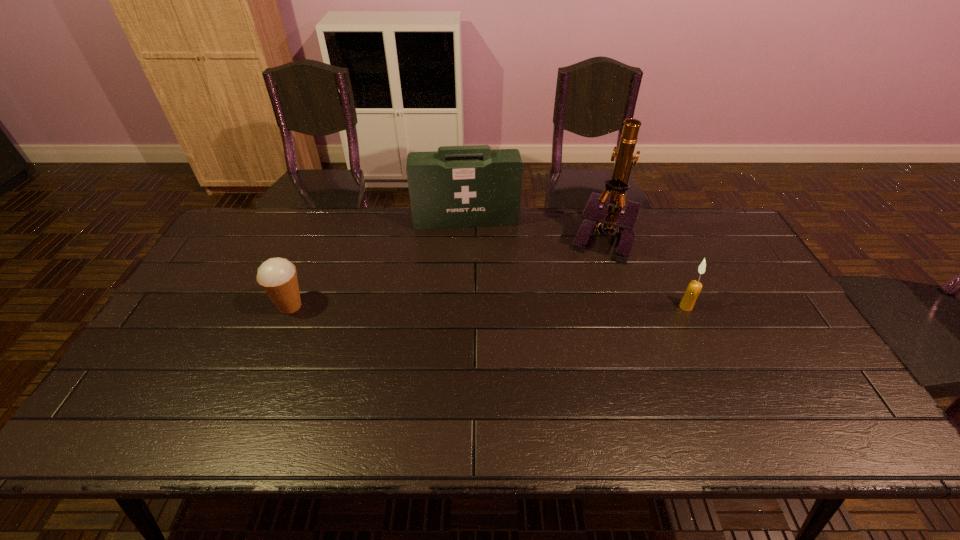
You are a GUI agent. You are given a task and a screenshot of the screen. Output one action in this format:
    pyautogui.click(x=<x>, y=<y>)
    Task: Click on the free spot between the rightmost object and the third object from left to right
    
    Given the screenshot: What is the action you would take?
    pyautogui.click(x=643, y=272)

Locate an element on the screen. The height and width of the screenshot is (540, 960). free space between the icecream and the rightmost object is located at coordinates (488, 306).

Choose which object is the nearest neighbor to the first-aid kit. Please provide its 2D coordinates. Your answer should be formatted as a tuple, i.e. [(x, y)], where the tuple contains the x and y coordinates of a point satisfying the conditions above.

[(619, 219)]

This screenshot has width=960, height=540. Identify the location of object that is the closest to the candle. (619, 219).

This screenshot has width=960, height=540. What are the coordinates of `vacant region that satisfies the following two spatial constraints: 1. on the front side of the third object from right to left; 2. on the right side of the candle` in the screenshot? It's located at (463, 307).

This screenshot has height=540, width=960. I want to click on free space that satisfies the following two spatial constraints: 1. on the front side of the rightmost object; 2. on the left side of the second object from right to left, so click(x=623, y=307).

You are a GUI agent. You are given a task and a screenshot of the screen. Output one action in this format:
    pyautogui.click(x=<x>, y=<y>)
    Task: Click on the free region that satisfies the following two spatial constraints: 1. on the back side of the icecream; 2. on the left side of the third object from right to left
    
    Given the screenshot: What is the action you would take?
    pyautogui.click(x=325, y=220)